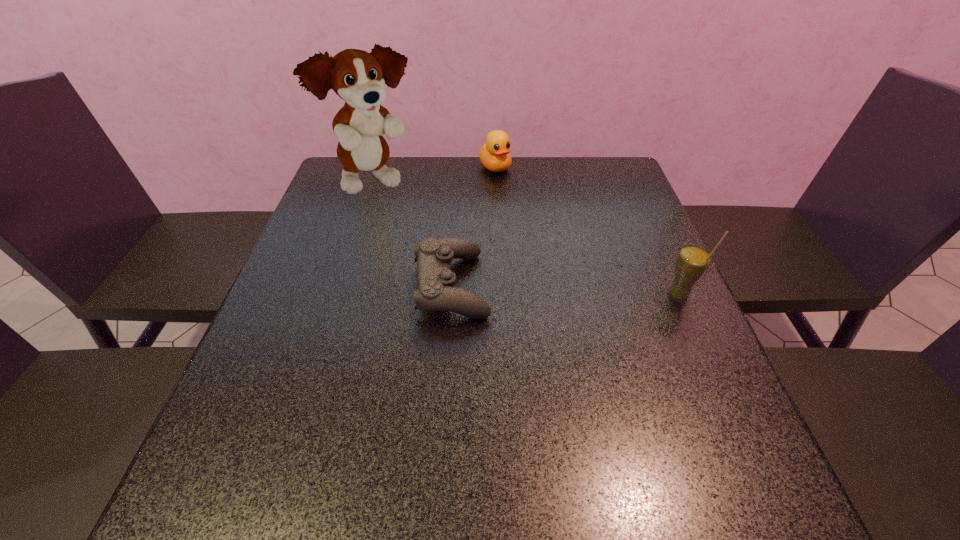
The height and width of the screenshot is (540, 960). I want to click on free space on the desktop that is between the control and the straw for drinking and is positioned on the face of the second shortest object, so click(593, 291).

I want to click on vacant space on the desktop that is between the shortest object and the straw for drinking and is positioned on the face of the leftmost object, so click(x=534, y=289).